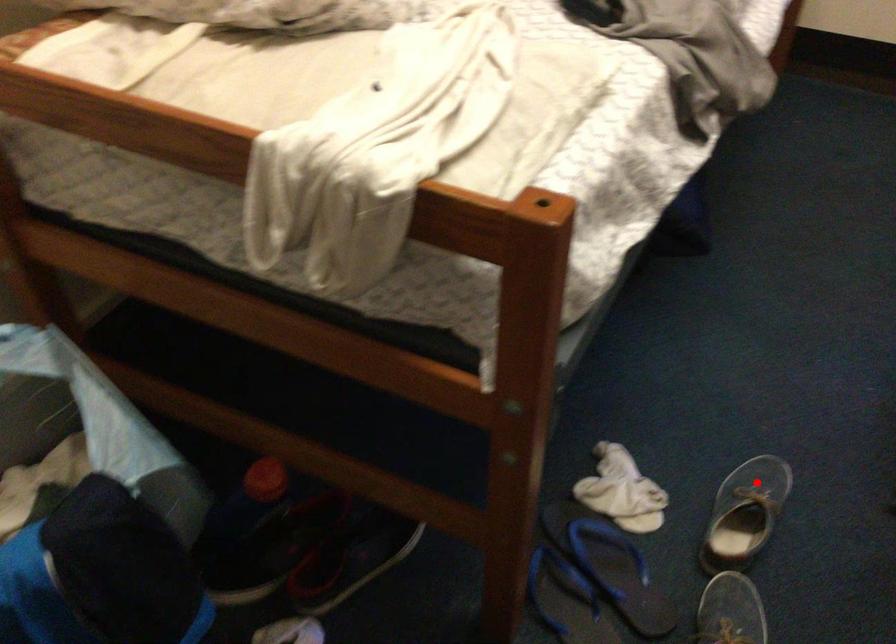
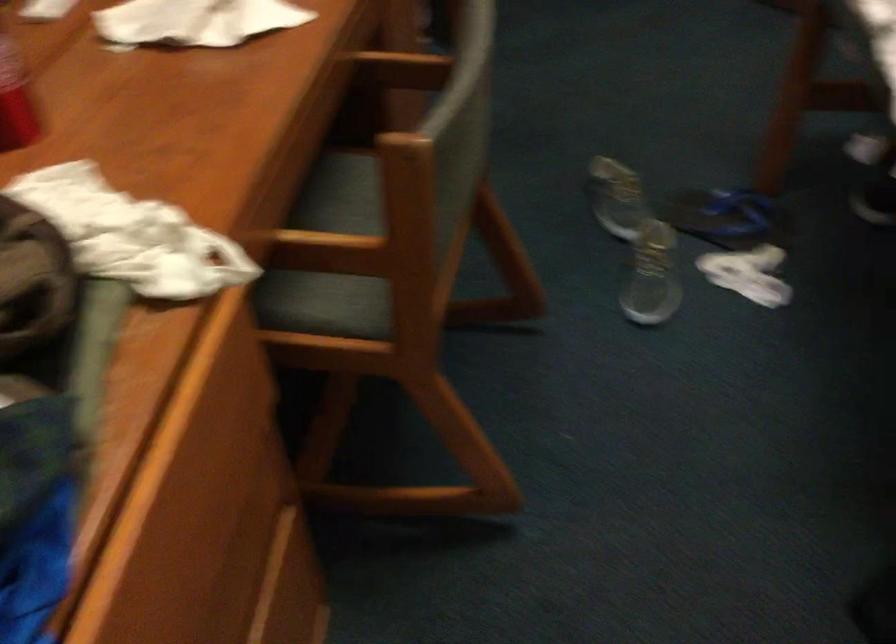
Question: I am providing you with two images of the same scene from different viewpoints. Image1 has a red point marked. In image2, the corresponding 3D location appears at what relative position? Reply with the corresponding letter.

Choices:
 (A) Closer
 (B) Farther

Answer: (B)